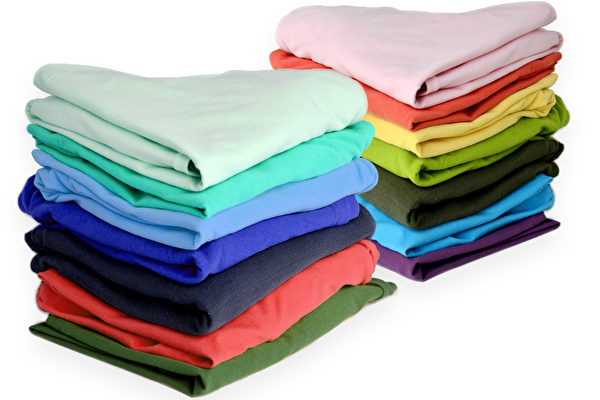
Identify the location of folded clothing on the right. The image size is (600, 400). (439, 266), (422, 238), (422, 209), (426, 174), (428, 142), (421, 118), (421, 82).